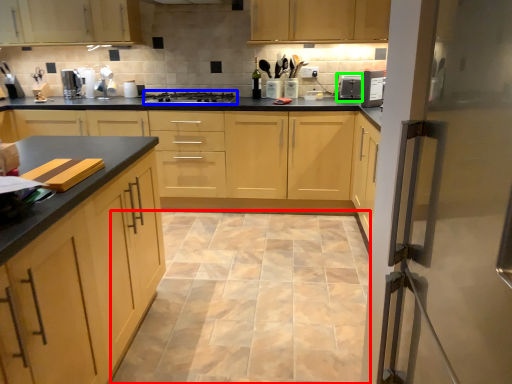
Question: Estimate the real-world distances between objects in this image. Which object is closer to ceramic tile (highlighted by a red box), gas stove (highlighted by a blue box) or appliance (highlighted by a green box)?

Choices:
 (A) gas stove
 (B) appliance

Answer: (A)